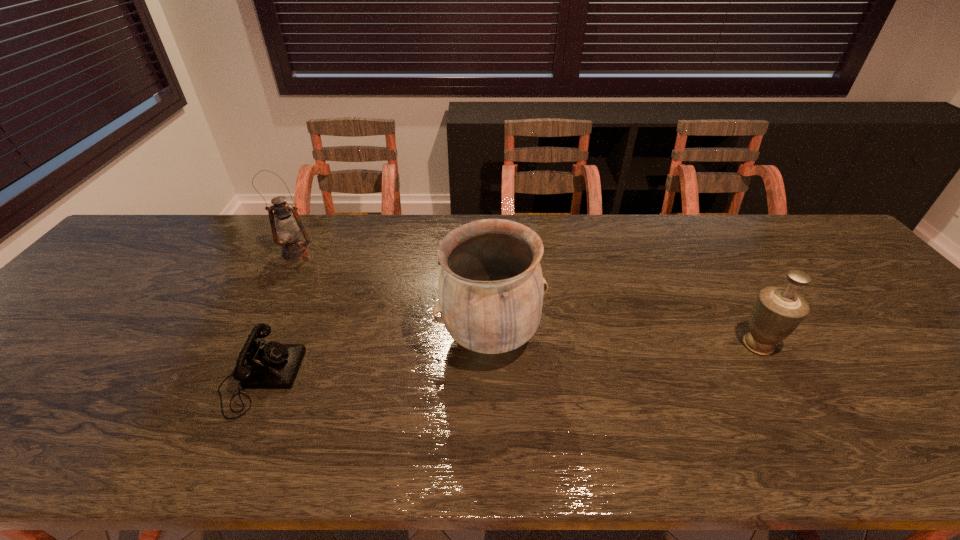
You are a GUI agent. You are given a task and a screenshot of the screen. Output one action in this format:
    pyautogui.click(x=<x>, y=<y>)
    Task: Click on the vacant space in between the taller urn and the rightmost object
    Image resolution: width=960 pixels, height=540 pixels.
    Given the screenshot: What is the action you would take?
    pyautogui.click(x=624, y=341)

Locate an element on the screen. Image resolution: width=960 pixels, height=540 pixels. vacant region between the right urn and the taller urn is located at coordinates (624, 341).

Where is `free space between the second shortest object and the shortest object`? The height and width of the screenshot is (540, 960). free space between the second shortest object and the shortest object is located at coordinates (509, 361).

Locate an element on the screen. Image resolution: width=960 pixels, height=540 pixels. vacant space in between the rightmost object and the shortest object is located at coordinates (509, 361).

Choose which object is the nearest neighbor to the right urn. Please provide its 2D coordinates. Your answer should be formatted as a tuple, i.e. [(x, y)], where the tuple contains the x and y coordinates of a point satisfying the conditions above.

[(491, 286)]

Locate an element on the screen. The width and height of the screenshot is (960, 540). object that is the closest one to the farthest object is located at coordinates (273, 365).

Locate an element on the screen. The height and width of the screenshot is (540, 960). free location that satisfies the following two spatial constraints: 1. on the front side of the left urn; 2. on the front face of the telephone is located at coordinates (492, 377).

This screenshot has width=960, height=540. What are the coordinates of `free space that satisfies the following two spatial constraints: 1. on the front side of the oil lamp; 2. on the left side of the third object from left to right` in the screenshot? It's located at (253, 337).

This screenshot has width=960, height=540. In order to click on blank space that satisfies the following two spatial constraints: 1. on the front side of the farthest object; 2. on the right side of the left urn in this screenshot , I will do `click(253, 337)`.